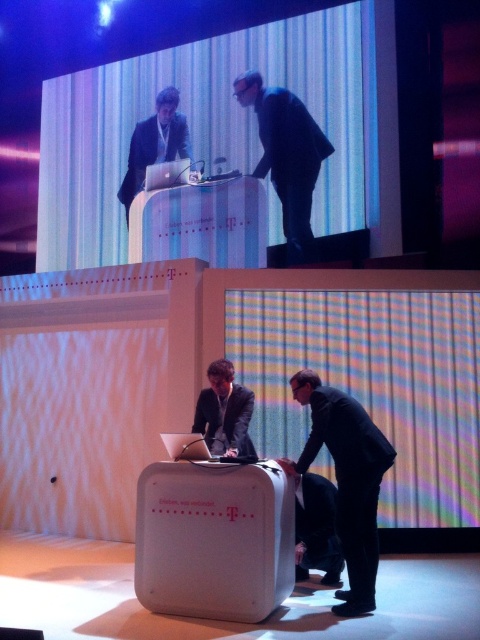
You are an event organizer planning to move a 1.2 meter wide banner between the two people in the image. The banner needs to be placed between the matte black suit at upper center and the dark gray suit at center. Can the banner fit in the space between them?

The matte black suit at upper center is positioned over the dark gray suit at center, so there is no space between them. The banner cannot fit between the matte black suit at upper center and the dark gray suit at center.

You are an event planner organizing a presentation. You need to decide seating arrangements based on height to ensure visibility. Given the two presenters in the image, the black matte suit at lower center and the dark gray suit at center, which one should be seated closer to the front to ensure the other can see over them?

The dark gray suit at center should be seated closer to the front because the black matte suit at lower center is much taller, so placing the shorter presenter in front would allow the taller presenter to see over them.

You are standing at the front of the stage and want to move from the point at coordinates point (128, 220) to the point at coordinates point (231, 428). Which direction should you move in relation to the stage setup?

To move from point (128, 220) to point (231, 428), you should move forward towards the front of the stage since point (128, 220) is behind point (231, 428).